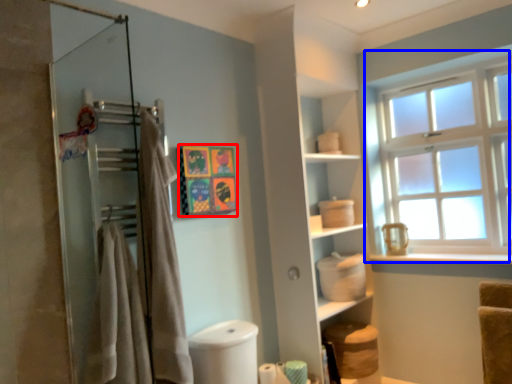
Question: Which object appears closest to the camera in this image, art (highlighted by a red box) or window (highlighted by a blue box)?

Choices:
 (A) art
 (B) window

Answer: (A)